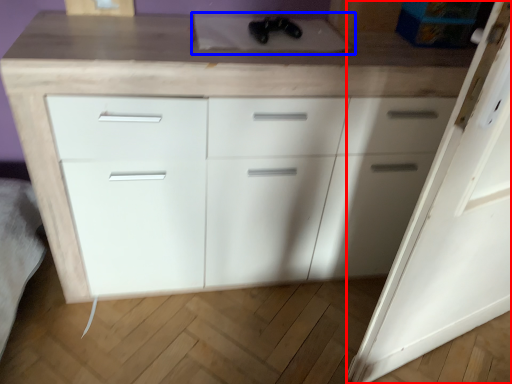
Question: Which object is closer to the camera taking this photo, door (highlighted by a red box) or sink (highlighted by a blue box)?

Choices:
 (A) door
 (B) sink

Answer: (A)